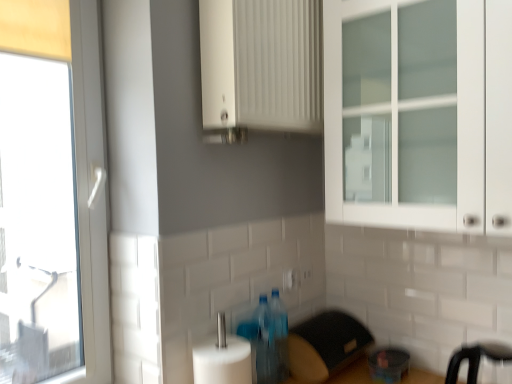
The width and height of the screenshot is (512, 384). What are the coordinates of `translucent plastic bottle at center, marked as the second bottle in a front-to-back arrangement` in the screenshot? It's located at (280, 334).

Image resolution: width=512 pixels, height=384 pixels. Describe the element at coordinates (280, 334) in the screenshot. I see `translucent plastic bottle at center, the first bottle viewed from the back` at that location.

In order to face white matte cabinet at upper center, should I rotate leftwards or rightwards?

To face it directly, rotate right by 2.869 degrees.

This screenshot has width=512, height=384. In order to click on black plastic toaster at lower center, the 2th appliance from the right in this screenshot , I will do `click(325, 345)`.

Identify the location of translucent plastic bottle at center, the first bottle viewed from the back. (280, 334).

Who is more distant, translucent plastic bottles at lower center, positioned as the 2th bottle in back-to-front order, or white plastic electric outlet at center, marked as the 1th electric outlet in a right-to-left arrangement?

white plastic electric outlet at center, marked as the 1th electric outlet in a right-to-left arrangement, is behind.

Does translucent plastic bottles at lower center, positioned as the 2th bottle in back-to-front order, have a larger size compared to white plastic electric outlet at center, marked as the 1th electric outlet in a right-to-left arrangement?

Yes.

This screenshot has width=512, height=384. I want to click on the 2nd bottle counting from the left side of the white plastic electric outlet at center, marked as the 1th electric outlet in a right-to-left arrangement, so click(x=265, y=344).

From a real-world perspective, relative to white plastic electric outlet at center, acting as the first electric outlet starting from the back, is translucent plastic bottles at lower center, the 1th bottle from the front, vertically above or below?

translucent plastic bottles at lower center, the 1th bottle from the front, is below white plastic electric outlet at center, acting as the first electric outlet starting from the back.

Does white plastic electric outlet at center, which is counted as the first electric outlet, starting from the left, lie in front of transparent plastic container at lower right, which appears as the first appliance when viewed from the right?

No.

From the image's perspective, is white plastic electric outlet at center, the 2th electric outlet in the back-to-front sequence, under transparent plastic container at lower right, which appears as the first appliance when viewed from the right?

No, from the image's perspective, white plastic electric outlet at center, the 2th electric outlet in the back-to-front sequence, is not below transparent plastic container at lower right, which appears as the first appliance when viewed from the right.

Is white plastic electric outlet at center, which is counted as the first electric outlet, starting from the left, placed right next to transparent plastic container at lower right, marked as the 2th appliance in a left-to-right arrangement?

white plastic electric outlet at center, which is counted as the first electric outlet, starting from the left, and transparent plastic container at lower right, marked as the 2th appliance in a left-to-right arrangement, are clearly separated.

Considering the sizes of objects white plastic electric outlet at center, which is counted as the first electric outlet, starting from the left, and transparent plastic container at lower right, marked as the 2th appliance in a left-to-right arrangement, in the image provided, who is thinner, white plastic electric outlet at center, which is counted as the first electric outlet, starting from the left, or transparent plastic container at lower right, marked as the 2th appliance in a left-to-right arrangement,?

white plastic electric outlet at center, which is counted as the first electric outlet, starting from the left, is thinner.

Is black plastic toaster at lower center, the 2th appliance from the right, wider or thinner than white plastic electric outlet at center, marked as the 1th electric outlet in a right-to-left arrangement?

In the image, black plastic toaster at lower center, the 2th appliance from the right, appears to be wider than white plastic electric outlet at center, marked as the 1th electric outlet in a right-to-left arrangement.

Between black plastic toaster at lower center, acting as the first appliance starting from the left, and white plastic electric outlet at center, the second electric outlet viewed from the front, which one has smaller size?

With smaller size is white plastic electric outlet at center, the second electric outlet viewed from the front.

Is black plastic toaster at lower center, the 2th appliance from the right, not close to white plastic electric outlet at center, acting as the first electric outlet starting from the back?

They are positioned close to each other.

How different are the orientations of black plastic toaster at lower center, acting as the first appliance starting from the left, and white plastic electric outlet at center, marked as the 1th electric outlet in a right-to-left arrangement, in degrees?

There is a 1.84-degree angle between the facing directions of black plastic toaster at lower center, acting as the first appliance starting from the left, and white plastic electric outlet at center, marked as the 1th electric outlet in a right-to-left arrangement.

Which object is wider, translucent plastic bottle at center, the first bottle viewed from the back, or white plastic electric outlet at center, the 2th electric outlet in the back-to-front sequence?

With larger width is translucent plastic bottle at center, the first bottle viewed from the back.

How distant is translucent plastic bottle at center, marked as the second bottle in a front-to-back arrangement, from white plastic electric outlet at center, the 2th electric outlet in the back-to-front sequence?

translucent plastic bottle at center, marked as the second bottle in a front-to-back arrangement, is 6.70 inches away from white plastic electric outlet at center, the 2th electric outlet in the back-to-front sequence.

Between translucent plastic bottle at center, the first bottle viewed from the back, and white plastic electric outlet at center, which is counted as the first electric outlet, starting from the left, which one has more height?

With more height is translucent plastic bottle at center, the first bottle viewed from the back.

Could you tell me if translucent plastic bottle at center, the first bottle viewed from the back, is turned towards white plastic electric outlet at center, which is counted as the 2th electric outlet, starting from the right?

No, translucent plastic bottle at center, the first bottle viewed from the back, is not facing towards white plastic electric outlet at center, which is counted as the 2th electric outlet, starting from the right.

From a real-world perspective, is white glass cabinet at upper right located beneath translucent plastic bottle at center, the first bottle viewed from the back?

Incorrect, from a real-world perspective, white glass cabinet at upper right is higher than translucent plastic bottle at center, the first bottle viewed from the back.

Considering the relative positions of white glass cabinet at upper right and translucent plastic bottle at center, marked as the second bottle in a front-to-back arrangement, in the image provided, is white glass cabinet at upper right to the left of translucent plastic bottle at center, marked as the second bottle in a front-to-back arrangement, from the viewer's perspective?

No, white glass cabinet at upper right is not to the left of translucent plastic bottle at center, marked as the second bottle in a front-to-back arrangement.

Considering the sizes of white glass cabinet at upper right and translucent plastic bottle at center, the first bottle viewed from the back, in the image, is white glass cabinet at upper right bigger or smaller than translucent plastic bottle at center, the first bottle viewed from the back,?

In the image, white glass cabinet at upper right appears to be larger than translucent plastic bottle at center, the first bottle viewed from the back.

Considering the points (473, 108) and (283, 353), which point is in front, point (473, 108) or point (283, 353)?

The point (473, 108) is closer.

Between black plastic bar stool at lower right and translucent plastic bottles at lower center, positioned as the 2th bottle in back-to-front order, which one appears on the left side from the viewer's perspective?

From the viewer's perspective, translucent plastic bottles at lower center, positioned as the 2th bottle in back-to-front order, appears more on the left side.

Which bottle is the 2nd one when counting from the left side of the black plastic bar stool at lower right? Please provide its 2D coordinates.

[(265, 344)]

Considering the sizes of objects black plastic bar stool at lower right and translucent plastic bottles at lower center, positioned as the 2th bottle in back-to-front order, in the image provided, who is taller, black plastic bar stool at lower right or translucent plastic bottles at lower center, positioned as the 2th bottle in back-to-front order,?

translucent plastic bottles at lower center, positioned as the 2th bottle in back-to-front order, is taller.

Is white plastic electric outlet at center, which is the first electric outlet from front to back, to the left or to the right of translucent plastic bottles at lower center, the 1th bottle from the front, in the image?

Clearly, white plastic electric outlet at center, which is the first electric outlet from front to back, is on the right of translucent plastic bottles at lower center, the 1th bottle from the front, in the image.

Which object is wider, white plastic electric outlet at center, the 2th electric outlet in the back-to-front sequence, or translucent plastic bottles at lower center, the 1th bottle from the front?

translucent plastic bottles at lower center, the 1th bottle from the front, is wider.

Looking at this image, which of these two, white plastic electric outlet at center, the 2th electric outlet in the back-to-front sequence, or translucent plastic bottles at lower center, positioned as the 2th bottle in back-to-front order, stands taller?

translucent plastic bottles at lower center, positioned as the 2th bottle in back-to-front order.

Which bottle is the 2nd one when counting from the front of the white plastic electric outlet at center, which appears as the 2th electric outlet when viewed from the left? Please provide its 2D coordinates.

[(265, 344)]

Find the location of a particular element. The height and width of the screenshot is (384, 512). the 2nd electric outlet above the transparent plastic container at lower right, marked as the 2th appliance in a left-to-right arrangement (from a real-world perspective) is located at coordinates point(290,279).

Estimate the real-world distances between objects in this image. Which object is closer to black plastic bar stool at lower right, white matte cabinet at upper center or black plastic toaster at lower center, the 2th appliance from the right?

black plastic toaster at lower center, the 2th appliance from the right, is positioned closer to the anchor black plastic bar stool at lower right.

Which object lies further to the anchor point transparent plastic container at lower right, which appears as the first appliance when viewed from the right, transparent glass window at left or white plastic electric outlet at center, the second electric outlet viewed from the front?

Among the two, transparent glass window at left is located further to transparent plastic container at lower right, which appears as the first appliance when viewed from the right.

Which object lies nearer to the anchor point white glass cabinet at upper right, white plastic electric outlet at center, marked as the 1th electric outlet in a right-to-left arrangement, or translucent plastic bottles at lower center, positioned as the 2th bottle in back-to-front order?

translucent plastic bottles at lower center, positioned as the 2th bottle in back-to-front order.

When comparing their distances from white glass cabinet at upper right, does translucent plastic bottle at center, marked as the second bottle in a front-to-back arrangement, or white matte cabinet at upper center seem further?

translucent plastic bottle at center, marked as the second bottle in a front-to-back arrangement.

Looking at this image, based on their spatial positions, is black plastic toaster at lower center, acting as the first appliance starting from the left, or transparent glass window at left closer to white matte cabinet at upper center?

The object closer to white matte cabinet at upper center is transparent glass window at left.

Looking at the image, which one is located closer to white plastic electric outlet at center, marked as the 1th electric outlet in a right-to-left arrangement, black plastic bar stool at lower right or transparent glass window at left?

black plastic bar stool at lower right lies closer to white plastic electric outlet at center, marked as the 1th electric outlet in a right-to-left arrangement, than the other object.

Looking at the image, which one is located further to translucent plastic bottles at lower center, the 1th bottle from the front, black plastic bar stool at lower right or translucent plastic bottle at center, marked as the second bottle in a front-to-back arrangement?

Among the two, black plastic bar stool at lower right is located further to translucent plastic bottles at lower center, the 1th bottle from the front.

Which object lies nearer to the anchor point white glass cabinet at upper right, white plastic electric outlet at center, which is the first electric outlet from front to back, or transparent glass window at left?

white plastic electric outlet at center, which is the first electric outlet from front to back, lies closer to white glass cabinet at upper right than the other object.

The image size is (512, 384). What are the coordinates of `electric outlet situated between white plastic electric outlet at center, which is the first electric outlet from front to back, and transparent plastic container at lower right, which appears as the first appliance when viewed from the right, from left to right` in the screenshot? It's located at (306, 272).

The image size is (512, 384). Identify the location of appliance between transparent glass window at left and transparent plastic container at lower right, which appears as the first appliance when viewed from the right. (325, 345).

I want to click on door between white matte cabinet at upper center and translucent plastic bottles at lower center, the 1th bottle from the front, in the up-down direction, so click(x=419, y=114).

Find the location of a particular element. Image resolution: width=512 pixels, height=384 pixels. bottle located between translucent plastic bottles at lower center, the 1th bottle from the front, and black plastic bar stool at lower right in the left-right direction is located at coordinates (280, 334).